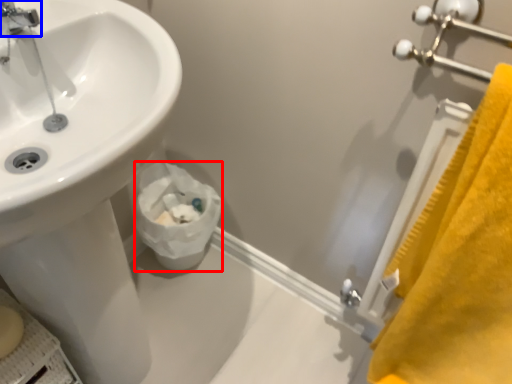
Question: Among these objects, which one is nearest to the camera, toilet paper (highlighted by a red box) or tap (highlighted by a blue box)?

Choices:
 (A) toilet paper
 (B) tap

Answer: (B)